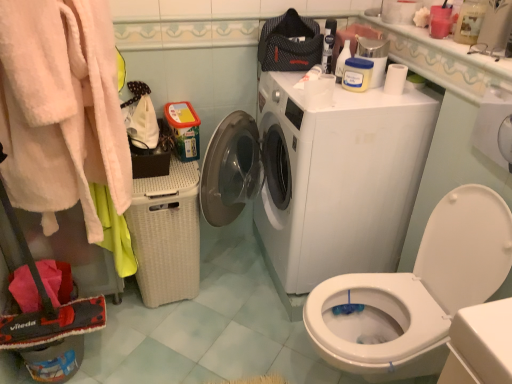
Question: Considering their positions, is white glossy washing machine at center located in front of or behind fluffy pink bathrobe at left?

Choices:
 (A) front
 (B) behind

Answer: (B)

Question: Considering the positions of white glossy washing machine at center and fluffy pink bathrobe at left in the image, is white glossy washing machine at center bigger or smaller than fluffy pink bathrobe at left?

Choices:
 (A) big
 (B) small

Answer: (A)

Question: Estimate the real-world distances between objects in this image. Which object is closer to the white glossy washing machine at center?

Choices:
 (A) white glossy toilet at lower right
 (B) white wicker laundry basket at left
 (C) fluffy pink bathrobe at left
 (D) white glossy countertop at upper right
 (E) white matte toilet paper at upper right, which appears as the 1th toilet paper when viewed from the left

Answer: (E)

Question: Which object is positioned closest to the white glossy washing machine at center?

Choices:
 (A) white wicker laundry basket at left
 (B) white glossy countertop at upper right
 (C) fluffy pink bathrobe at left
 (D) white matte toilet paper at upper right, acting as the second toilet paper starting from the right
 (E) white glossy toilet at lower right

Answer: (D)